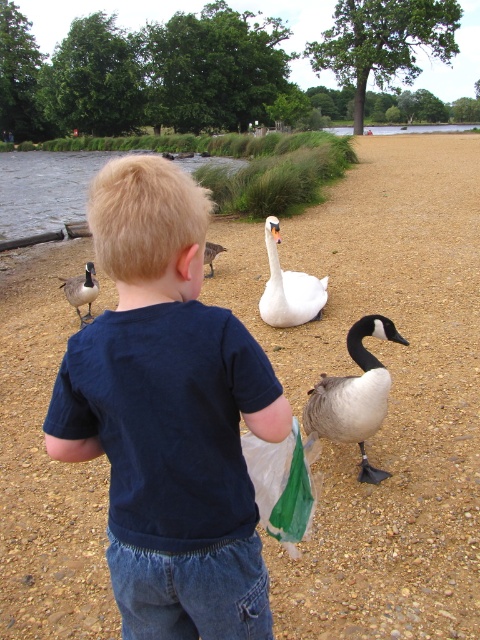
Question: Does blue cotton shirt at center come in front of clear water at lower center?

Choices:
 (A) yes
 (B) no

Answer: (A)

Question: Which of the following is the closest to the observer?

Choices:
 (A) white glossy swan at center
 (B) blue cotton shirt at center

Answer: (B)

Question: Does green plastic bag at lower center have a smaller size compared to white matte duck at center?

Choices:
 (A) yes
 (B) no

Answer: (B)

Question: Is blue cotton shirt at center wider than white glossy swan at center?

Choices:
 (A) no
 (B) yes

Answer: (A)

Question: Considering the real-world distances, which object is closest to the white glossy swan at center?

Choices:
 (A) brown speckled feathered goose at center
 (B) blue cotton shirt at center
 (C) clear water at lower center
 (D) green plastic bag at lower center

Answer: (A)

Question: Based on their relative distances, which object is nearer to the clear water at lower center?

Choices:
 (A) green plastic bag at lower center
 (B) brown speckled feathered goose at center
 (C) clear water at lower left

Answer: (C)